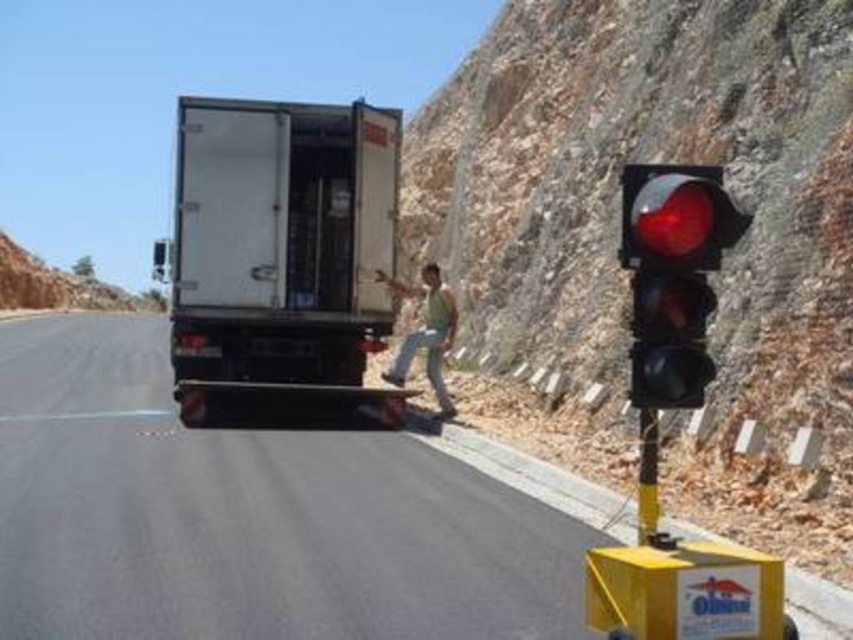
Question: Is white matte trailer truck at center positioned before red plastic traffic light at right?

Choices:
 (A) yes
 (B) no

Answer: (B)

Question: Which of the following is the farthest from the observer?

Choices:
 (A) (341, 493)
 (B) (433, 360)
 (C) (728, 225)
 (D) (265, 216)

Answer: (B)

Question: Does white matte trailer truck at center appear over green fabric shirt at center?

Choices:
 (A) no
 (B) yes

Answer: (B)

Question: Which point appears closest to the camera in this image?

Choices:
 (A) (358, 324)
 (B) (427, 269)
 (C) (631, 240)

Answer: (C)

Question: Does red plastic traffic light at right appear on the right side of green fabric shirt at center?

Choices:
 (A) no
 (B) yes

Answer: (B)

Question: Considering the real-world distances, which object is closest to the white matte trailer truck at center?

Choices:
 (A) green fabric shirt at center
 (B) red plastic traffic light at right

Answer: (A)